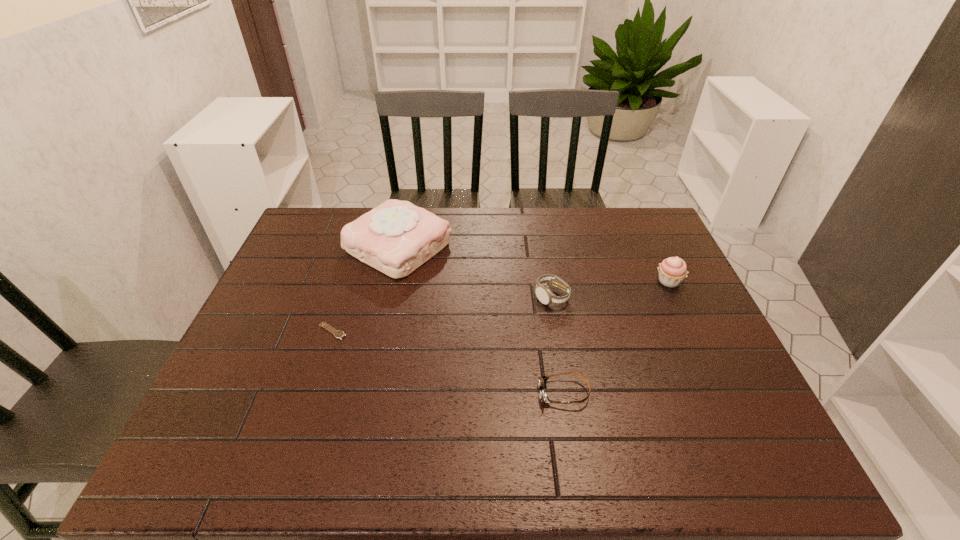
You are a GUI agent. You are given a task and a screenshot of the screen. Output one action in this format:
    pyautogui.click(x=<x>, y=<y>)
    Task: Click on the tallest object
    The image size is (960, 540).
    Given the screenshot: What is the action you would take?
    pyautogui.click(x=396, y=237)

Locate an element on the screen. the second tallest object is located at coordinates (672, 271).

At what (x,y) coordinates should I click in order to perform the action: click on cupcake. Please return your answer as a coordinate pair (x, y). Looking at the image, I should click on (672, 271).

The image size is (960, 540). Find the location of `the taller watch`. the taller watch is located at coordinates (545, 296).

Locate an element on the screen. the third shortest object is located at coordinates (545, 296).

Find the location of `the nearest object`. the nearest object is located at coordinates (542, 380).

At what (x,y) coordinates should I click in order to perform the action: click on goggles. Please return your answer as a coordinate pair (x, y). Looking at the image, I should click on (542, 380).

You are a GUI agent. You are given a task and a screenshot of the screen. Output one action in this format:
    pyautogui.click(x=<x>, y=<y>)
    Task: Click on the nearer watch
    
    Given the screenshot: What is the action you would take?
    pyautogui.click(x=338, y=334)

Where is `the shortest object`? This screenshot has height=540, width=960. the shortest object is located at coordinates 338,334.

At what (x,y) coordinates should I click in order to perform the action: click on free location located on the front of the cake. Please return your answer as a coordinate pair (x, y). Looking at the image, I should click on (374, 353).